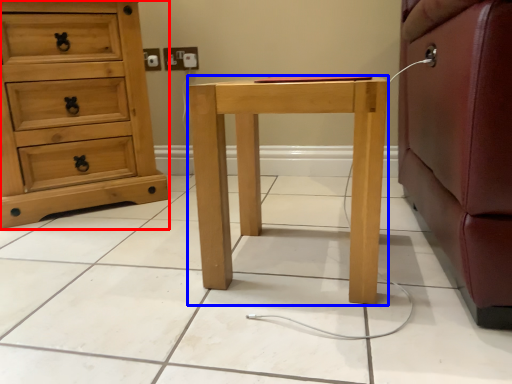
Question: Which object is further to the camera taking this photo, chest of drawers (highlighted by a red box) or nightstand (highlighted by a blue box)?

Choices:
 (A) chest of drawers
 (B) nightstand

Answer: (A)